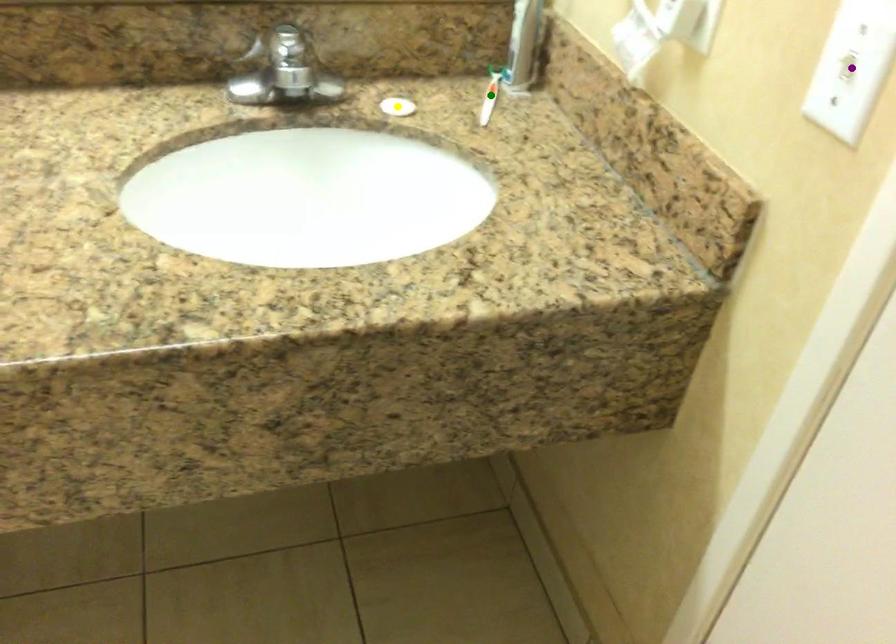
Order these from farthest to nearest:
1. purple point
2. yellow point
3. green point

green point
yellow point
purple point